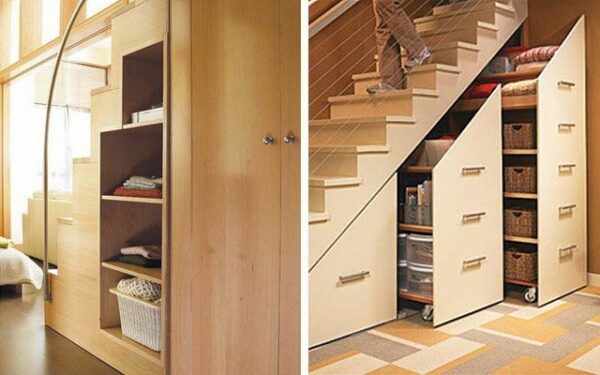
Where is `plastic box`? This screenshot has height=375, width=600. plastic box is located at coordinates (420, 282), (417, 254), (400, 244), (400, 274).